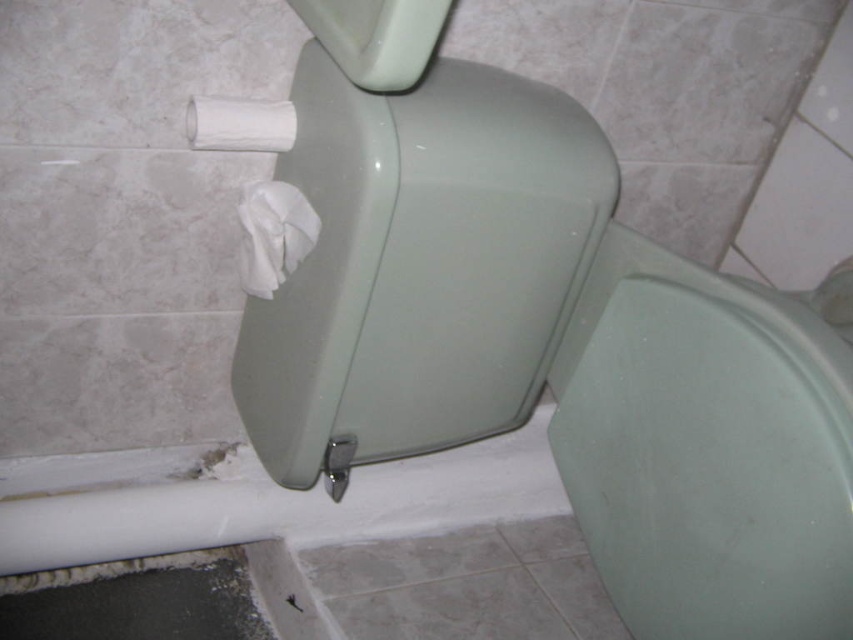
You are a cleaning robot in a bathroom. You need to clean the matte green toilet bowl at center and the white matte toilet paper at upper left. Which object should you clean first if you want to start with the one closer to you?

The matte green toilet bowl at center is closer to the viewer than the white matte toilet paper at upper left, so you should clean the matte green toilet bowl at center first.

You are standing in the bathroom and need to grab the nearest toilet paper. There are two rolls visible in the scene. Which one should you take? The white matte toilet paper at center or the white matte toilet paper at upper left?

The white matte toilet paper at center is closer to the viewer, so you should take the white matte toilet paper at center.

You are a maintenance worker inspecting the bathroom. You need to check the position of the matte green toilet bowl at center and the white matte toilet paper at upper left. Is the toilet bowl located below the toilet paper?

Yes, the matte green toilet bowl at center is below the white matte toilet paper at upper left according to the description.